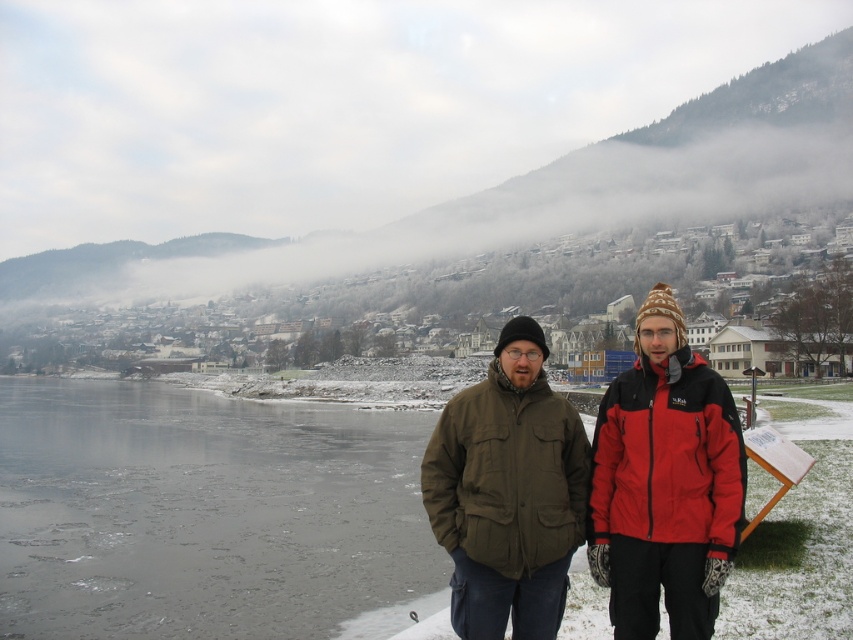
Is point (709, 458) farther from viewer compared to point (508, 394)?

No, it is in front of (508, 394).

Which is more to the left, matte green jacket at center or olive green fabric jacket at center?

olive green fabric jacket at center

Where is `matte green jacket at center`? The height and width of the screenshot is (640, 853). matte green jacket at center is located at coordinates (664, 483).

Consider the image. Does frozen ice at lower left have a lesser height compared to red fleece jacket at center?

Yes, frozen ice at lower left is shorter than red fleece jacket at center.

I want to click on frozen ice at lower left, so click(207, 515).

Between point (132, 508) and point (654, 480), which one is positioned behind?

The point (132, 508) is more distant.

Locate an element on the screen. The height and width of the screenshot is (640, 853). frozen ice at lower left is located at coordinates (207, 515).

Which is below, red fleece jacket at center or olive green fabric jacket at center?

Positioned lower is olive green fabric jacket at center.

What do you see at coordinates (664, 483) in the screenshot?
I see `red fleece jacket at center` at bounding box center [664, 483].

Who is more forward, (598, 531) or (494, 592)?

Positioned in front is point (494, 592).

Locate an element on the screen. The image size is (853, 640). red fleece jacket at center is located at coordinates (664, 483).